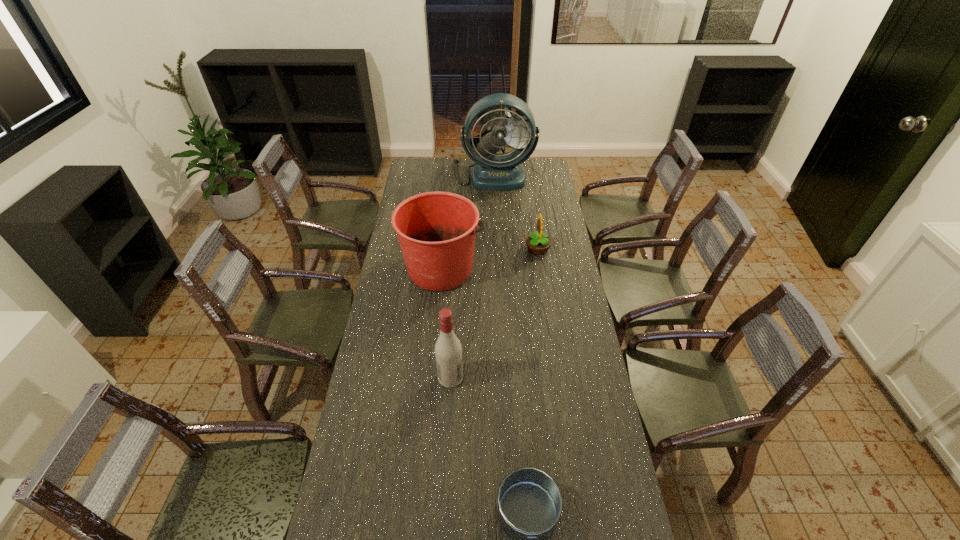
Locate an element on the screen. Image resolution: width=960 pixels, height=540 pixels. blank space located 0.280m on the face of the fourth tallest object is located at coordinates (465, 248).

You are a GUI agent. You are given a task and a screenshot of the screen. Output one action in this format:
    pyautogui.click(x=<x>, y=<y>)
    Task: Click on the object that is at the far edge
    Image resolution: width=960 pixels, height=540 pixels.
    Given the screenshot: What is the action you would take?
    pyautogui.click(x=493, y=171)

Find the location of a particular element. The height and width of the screenshot is (540, 960). object positioned at the left edge is located at coordinates (436, 231).

This screenshot has height=540, width=960. I want to click on fan at the right edge, so click(x=493, y=171).

Where is `sunflower that is at the right edge`? sunflower that is at the right edge is located at coordinates (538, 243).

This screenshot has height=540, width=960. I want to click on object present at the far right corner, so click(493, 171).

At what (x,y) coordinates should I click in order to perform the action: click on vacant space at the left edge of the desktop. Please return your answer as a coordinate pair (x, y). Looking at the image, I should click on (404, 411).

This screenshot has height=540, width=960. What are the coordinates of `free space at the right edge` in the screenshot? It's located at (581, 326).

I want to click on blank space at the far left corner, so click(x=412, y=179).

Identify the location of free space at the far right corner of the desktop. This screenshot has height=540, width=960. (536, 161).